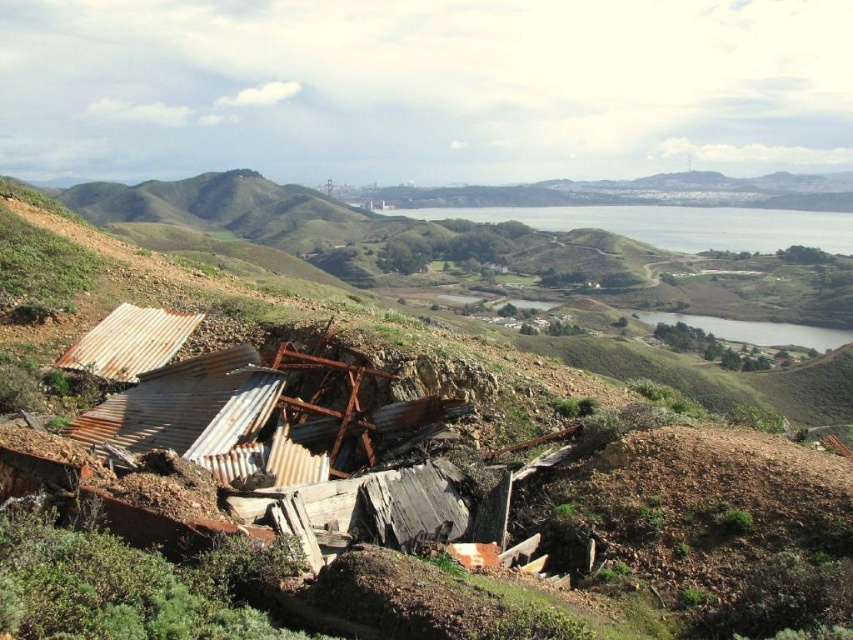
Question: Can you confirm if rusty corrugated metal at lower left is positioned above green grassy lake at center?

Choices:
 (A) yes
 (B) no

Answer: (B)

Question: Which object appears closest to the camera in this image?

Choices:
 (A) green grassy lake at center
 (B) rusty corrugated metal at lower left

Answer: (B)

Question: Which object appears farthest from the camera in this image?

Choices:
 (A) rusty corrugated metal at lower left
 (B) green grassy lake at center

Answer: (B)

Question: Observing the image, what is the correct spatial positioning of rusty corrugated metal at lower left in reference to green grassy lake at center?

Choices:
 (A) left
 (B) right

Answer: (A)

Question: Among these objects, which one is farthest from the camera?

Choices:
 (A) green grassy lake at center
 (B) rusty corrugated metal at lower left

Answer: (A)

Question: In this image, where is rusty corrugated metal at lower left located relative to green grassy lake at center?

Choices:
 (A) below
 (B) above

Answer: (A)